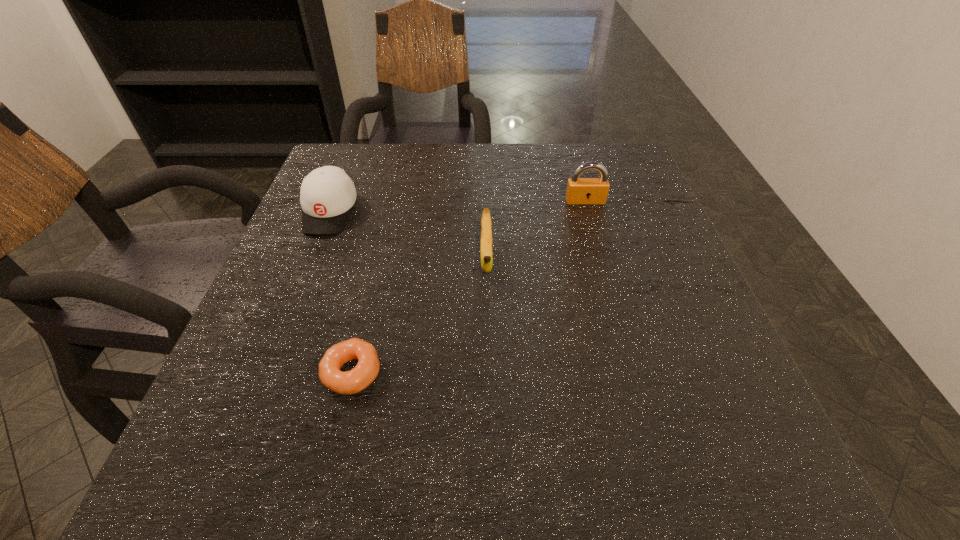
Locate an element on the screen. The image size is (960, 540). empty location between the baseball cap and the shortest object is located at coordinates (341, 292).

This screenshot has height=540, width=960. I want to click on vacant space in between the rightmost object and the doughnut, so click(468, 287).

The image size is (960, 540). What are the coordinates of `unoccupied position between the second object from right to left and the leftmost object` in the screenshot? It's located at (408, 236).

The width and height of the screenshot is (960, 540). I want to click on vacant point located between the rightmost object and the shortest object, so click(x=468, y=287).

What are the coordinates of `free space that is in between the banana and the padlock` in the screenshot? It's located at (536, 231).

Find the location of a particular element. The width and height of the screenshot is (960, 540). vacant area that lies between the nearest object and the second object from right to left is located at coordinates (420, 316).

At what (x,y) coordinates should I click in order to perform the action: click on free point between the banana and the leftmost object. Please return your answer as a coordinate pair (x, y). The width and height of the screenshot is (960, 540). Looking at the image, I should click on (408, 236).

Locate an element on the screen. The image size is (960, 540). empty space that is in between the third object from left to right and the nearest object is located at coordinates (420, 316).

I want to click on unoccupied position between the padlock and the banana, so click(536, 231).

This screenshot has width=960, height=540. I want to click on the third closest object relative to the leftmost object, so click(580, 191).